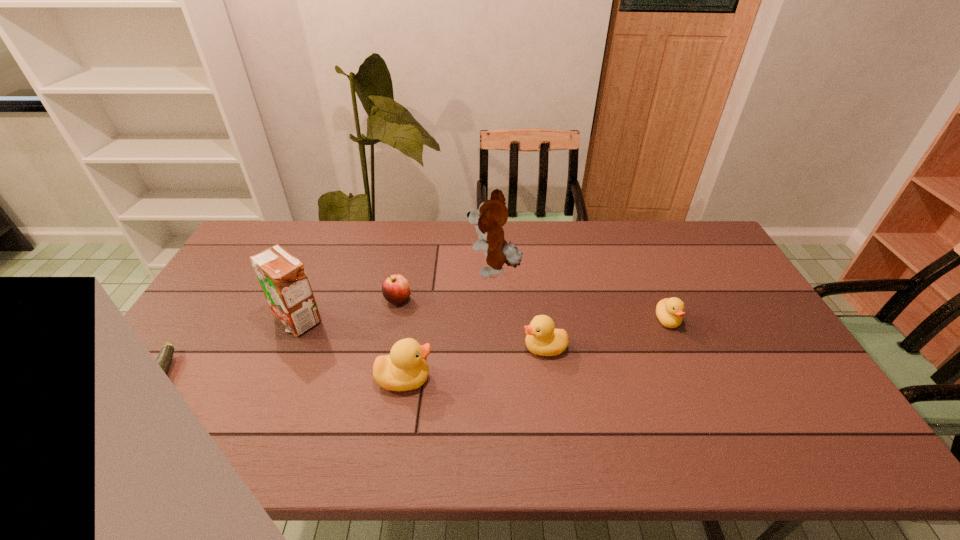
Image resolution: width=960 pixels, height=540 pixels. I want to click on object that is the closest to the rightmost object, so click(542, 338).

Select which object appears as the fourth closest to the shortest duckling. Please provide its 2D coordinates. Your answer should be formatted as a tuple, i.e. [(x, y)], where the tuple contains the x and y coordinates of a point satisfying the conditions above.

[(395, 288)]

Locate which duckling ranks in proximity to the apple. Please provide its 2D coordinates. Your answer should be formatted as a tuple, i.e. [(x, y)], where the tuple contains the x and y coordinates of a point satisfying the conditions above.

[(405, 369)]

Where is `the second closest duckling to the second tallest duckling`? The width and height of the screenshot is (960, 540). the second closest duckling to the second tallest duckling is located at coordinates (669, 311).

Locate an element on the screen. free space that satisfies the following two spatial constraints: 1. on the face of the second shortest duckling; 2. at the blossom end of the shortest object is located at coordinates (548, 377).

Find the location of `free point that satisfies the following two spatial constraints: 1. on the face of the shortest duckling; 2. on the face of the second duckling from left to right`. free point that satisfies the following two spatial constraints: 1. on the face of the shortest duckling; 2. on the face of the second duckling from left to right is located at coordinates (680, 348).

Where is `vacant space that satisfies the following two spatial constraints: 1. on the face of the rightmost duckling; 2. on the face of the second shortest duckling`? This screenshot has width=960, height=540. vacant space that satisfies the following two spatial constraints: 1. on the face of the rightmost duckling; 2. on the face of the second shortest duckling is located at coordinates (680, 348).